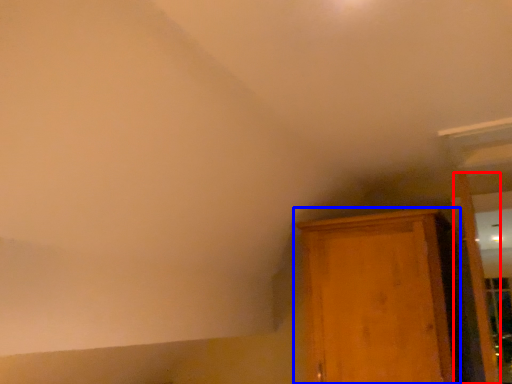
Question: Among these objects, which one is nearest to the camera, door (highlighted by a red box) or cupboard (highlighted by a blue box)?

Choices:
 (A) door
 (B) cupboard

Answer: (A)